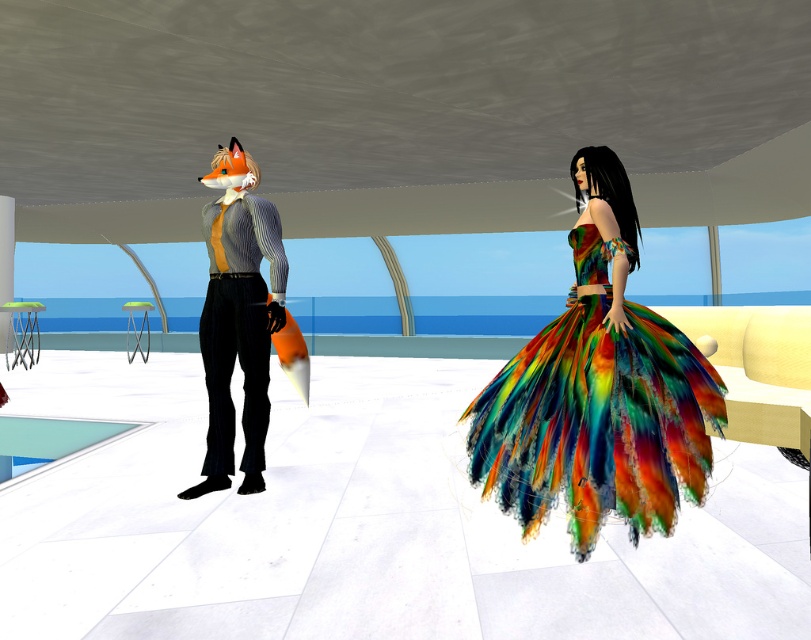
Can you confirm if rainbow feather dress at center is smaller than matte striped shirt at center?

No, rainbow feather dress at center is not smaller than matte striped shirt at center.

Based on the photo, which is more to the right, rainbow feather dress at center or matte striped shirt at center?

rainbow feather dress at center

Is point (685, 371) less distant than point (222, 269)?

Yes, it is.

Identify the location of rainbow feather dress at center. tap(597, 413).